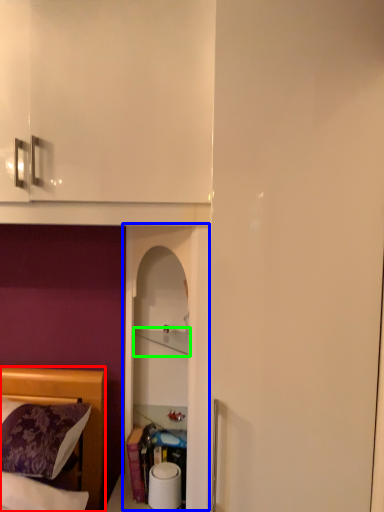
Question: Which object is positioned closest to bed (highlighted by a red box)? Select from glass door (highlighted by a blue box) and cabinet (highlighted by a green box).

Choices:
 (A) glass door
 (B) cabinet

Answer: (A)